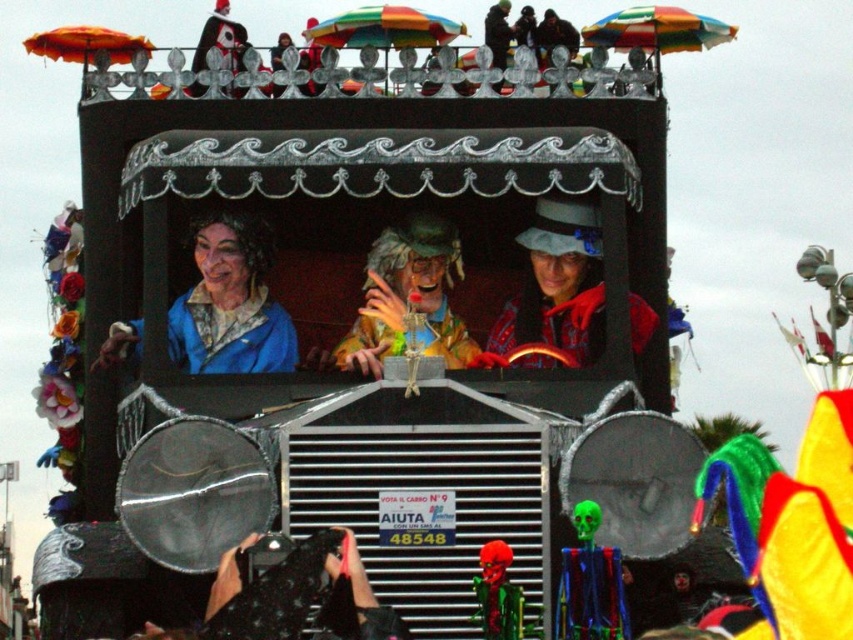
In the scene shown: In the festive parade scene, you notice two people wearing the matte yellow costume at center and the dark brown leather jacket at upper center. Which one is positioned to the left?

The matte yellow costume at center is to the left of dark brown leather jacket at upper center.

You are standing at the starting point of the parade route and see two points marked in the image. The first point is at coordinate point [596,227] and the second point is at coordinate point [479,592]. If you want to walk towards the float, which point should you aim for first?

You should aim for point [479,592] first because it is in front of point [596,227], so reaching it first would place you closer to the float.

You are a photographer trying to capture a clear shot of both the red fabric hat at center and the shiny green skull at lower center. Based on their positions, which object should you focus on first to ensure both are in frame?

The red fabric hat at center is positioned on the right side of shiny green skull at lower center, so you should focus on the shiny green skull at lower center first to ensure both are in frame.